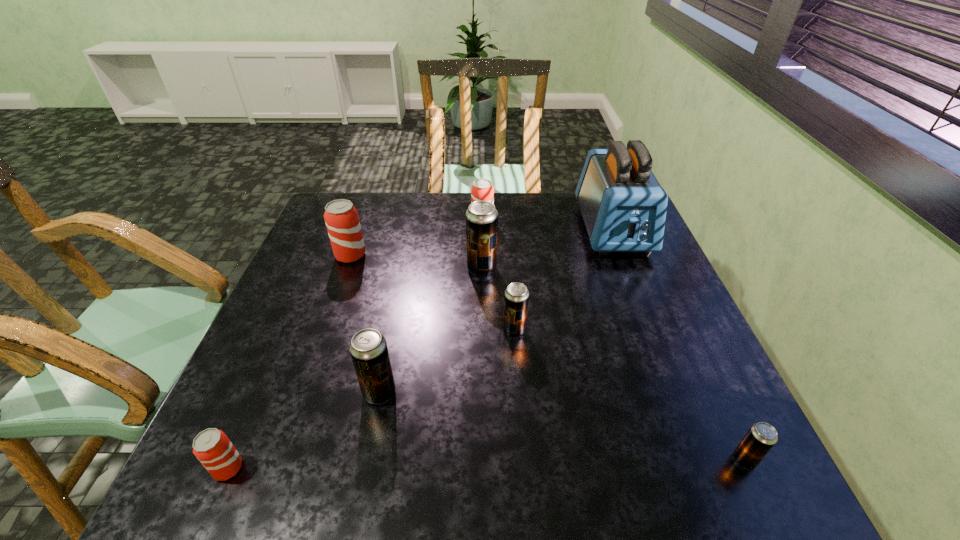
Find the location of a particular element. the fifth farthest object is located at coordinates (516, 297).

The image size is (960, 540). I want to click on the third biggest black beer can, so click(x=516, y=297).

Where is `the nearest black beer can`? Image resolution: width=960 pixels, height=540 pixels. the nearest black beer can is located at coordinates tap(761, 437).

Locate an element on the screen. the smallest black beer can is located at coordinates (761, 437).

Identify the location of the leftmost beer can. The height and width of the screenshot is (540, 960). (212, 447).

Locate an element on the screen. The image size is (960, 540). the leftmost object is located at coordinates point(212,447).

Where is `free location located on the front-facing side of the tallest object`? The width and height of the screenshot is (960, 540). free location located on the front-facing side of the tallest object is located at coordinates (631, 275).

Locate an element on the screen. The image size is (960, 540). vacant space located on the front of the second tallest object is located at coordinates (482, 334).

The image size is (960, 540). I want to click on blank area located on the front of the biggest orange beer can, so click(x=307, y=378).

The height and width of the screenshot is (540, 960). In order to click on vacant space situated on the back of the third farthest black beer can in this screenshot , I will do `click(392, 330)`.